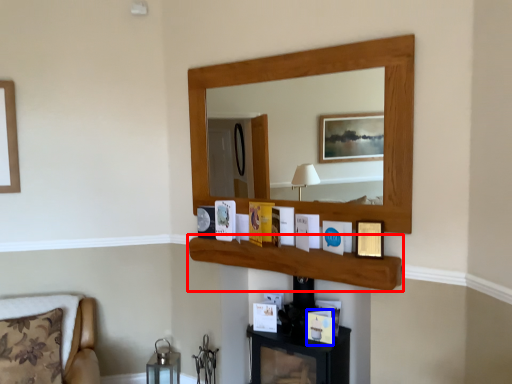
Question: Among these objects, which one is farthest to the camera, cabinet (highlighted by a red box) or picture frame (highlighted by a blue box)?

Choices:
 (A) cabinet
 (B) picture frame

Answer: (B)